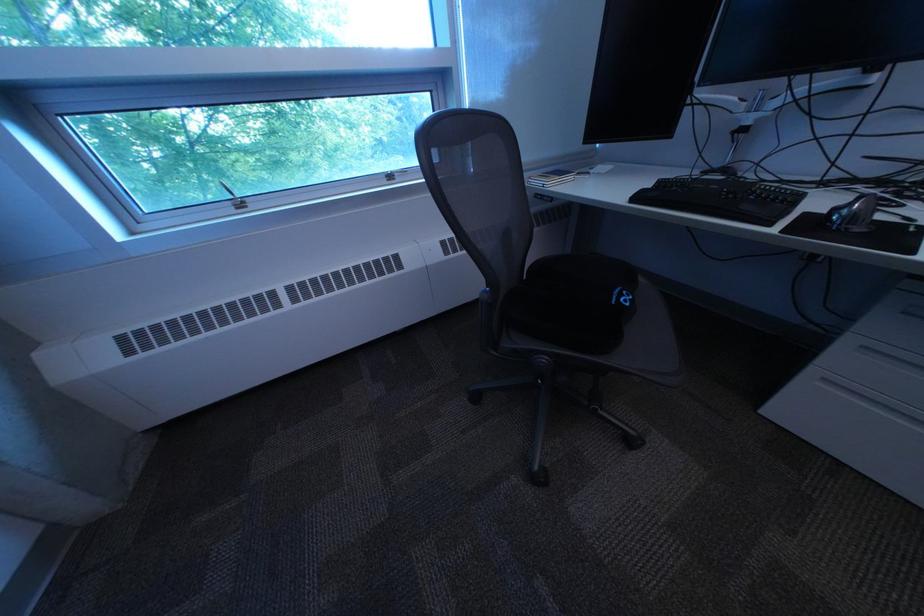
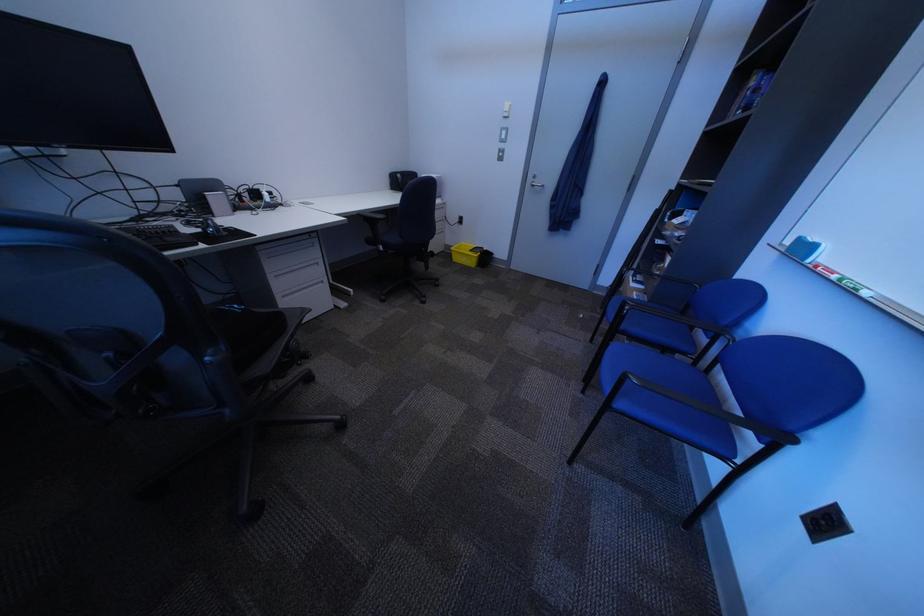
Find the pixel in the second image that matches [642,306] in the first image.

(259, 309)